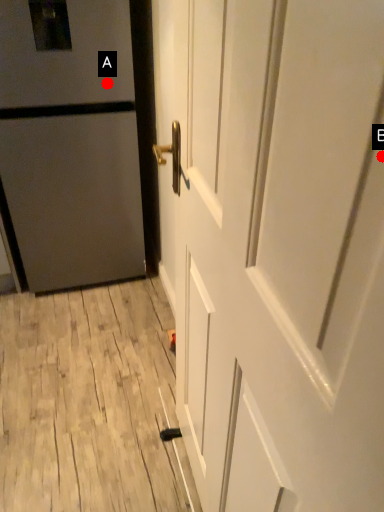
Question: Two points are circled on the image, labeled by A and B beside each circle. Which point is closer to the camera?

Choices:
 (A) A is closer
 (B) B is closer

Answer: (B)